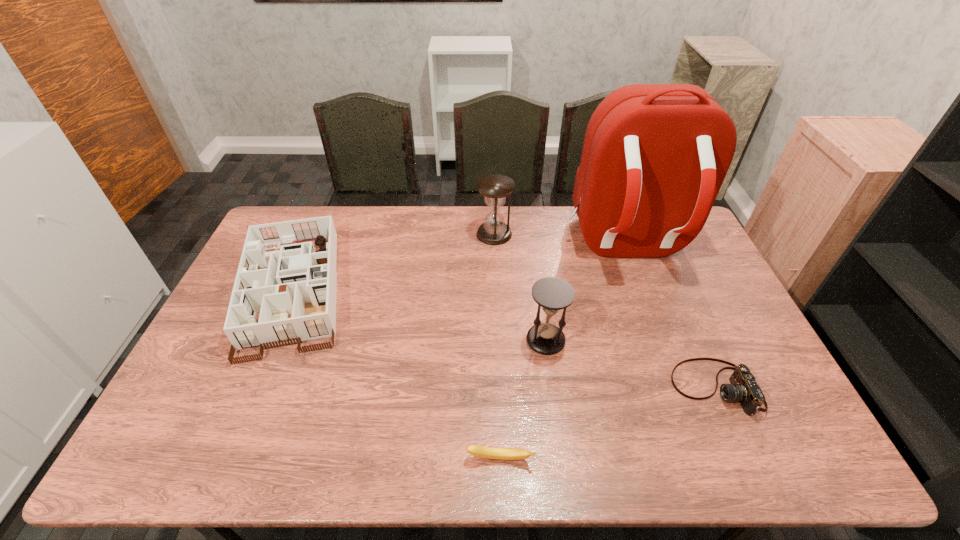
Where is `unoccupied position between the left hourglass and the camera`? Image resolution: width=960 pixels, height=540 pixels. unoccupied position between the left hourglass and the camera is located at coordinates (605, 311).

Find the location of a particular element. The image size is (960, 540). free spot between the farther hourglass and the nearer hourglass is located at coordinates pyautogui.click(x=520, y=287).

Where is `vacant space that is in between the banana and the camera`? The image size is (960, 540). vacant space that is in between the banana and the camera is located at coordinates (608, 423).

Locate an element on the screen. This screenshot has width=960, height=540. blank region between the nearer hourglass and the dollhouse is located at coordinates pyautogui.click(x=420, y=315).

This screenshot has height=540, width=960. In order to click on empty space between the camera and the tallest object in this screenshot , I will do `click(670, 316)`.

Where is `blank region between the camera and the dollhouse`? blank region between the camera and the dollhouse is located at coordinates point(504,339).

Identify the location of empty space between the farther hourglass and the backpack. (560, 240).

This screenshot has height=540, width=960. I want to click on blank region between the backpack and the left hourglass, so click(560, 240).

Identify which object is the fourth closest to the third object from right to left. Please provide its 2D coordinates. Your answer should be formatted as a tuple, i.e. [(x, y)], where the tuple contains the x and y coordinates of a point satisfying the conditions above.

[(495, 188)]

Locate an element on the screen. object that is the fifth closest to the nearer hourglass is located at coordinates (294, 289).